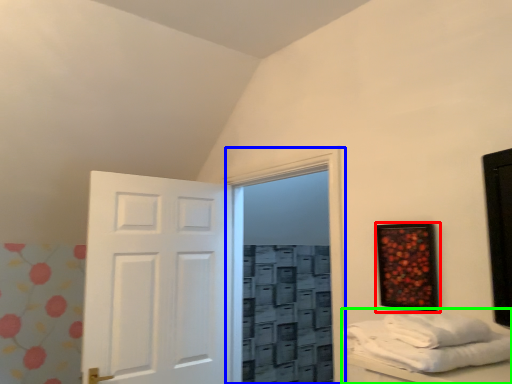
Question: Based on their relative distances, which object is nearer to picture frame (highlighted by a red box)? Choose from glass door (highlighted by a blue box) and furniture (highlighted by a green box).

Choices:
 (A) glass door
 (B) furniture

Answer: (A)